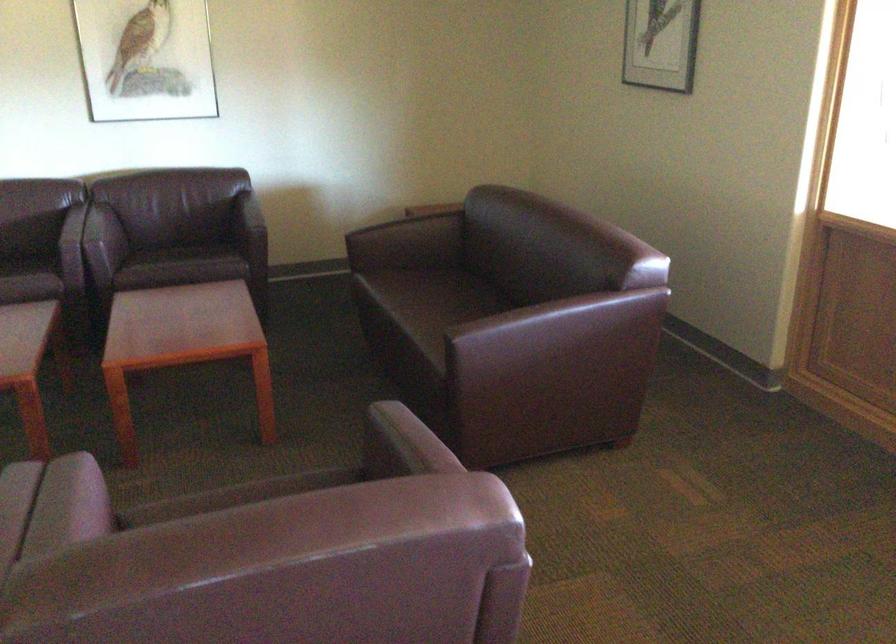
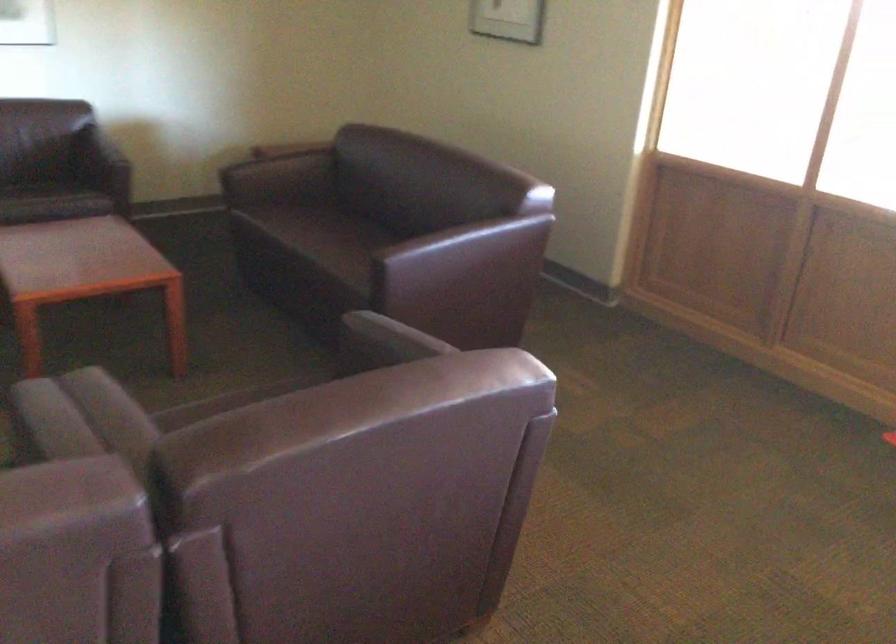
Question: Based on the continuous images, in which direction is the camera rotating? Reply with the corresponding letter.

Choices:
 (A) Left
 (B) Right
 (C) Up
 (D) Down

Answer: (B)